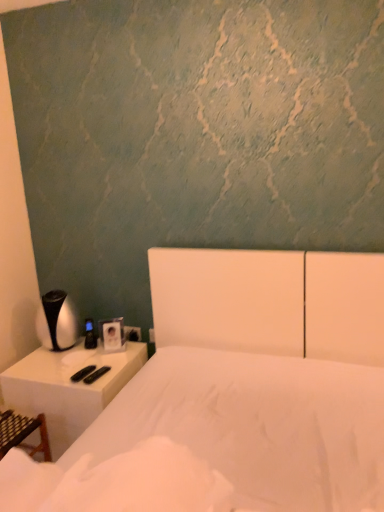
The height and width of the screenshot is (512, 384). I want to click on blank space situated above white plastic nightstand at left (from a real-world perspective), so click(73, 360).